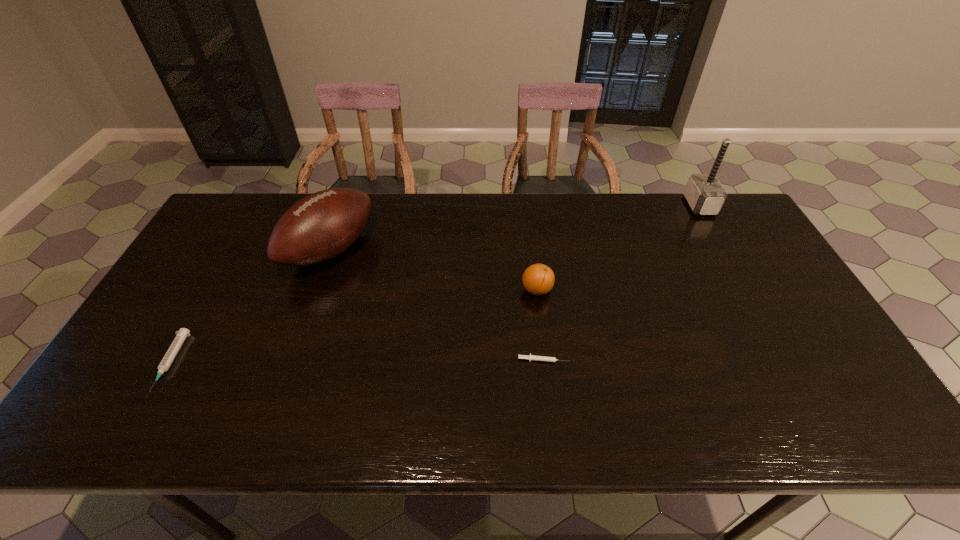
Where is `vacant region that satisfies the following two spatial constraints: 1. for striking with the head of the rightmost object; 2. at the needle end of the leftmost object`? vacant region that satisfies the following two spatial constraints: 1. for striking with the head of the rightmost object; 2. at the needle end of the leftmost object is located at coordinates pos(789,362).

In order to click on free location that satisfies the following two spatial constraints: 1. for striking with the head of the tallest object; 2. at the needle end of the taller syringe in this screenshot , I will do `click(789, 362)`.

Where is `free space that satisfies the following two spatial constraints: 1. for striking with the head of the farthest object; 2. at the needle end of the fourth tallest object`? free space that satisfies the following two spatial constraints: 1. for striking with the head of the farthest object; 2. at the needle end of the fourth tallest object is located at coordinates (789, 362).